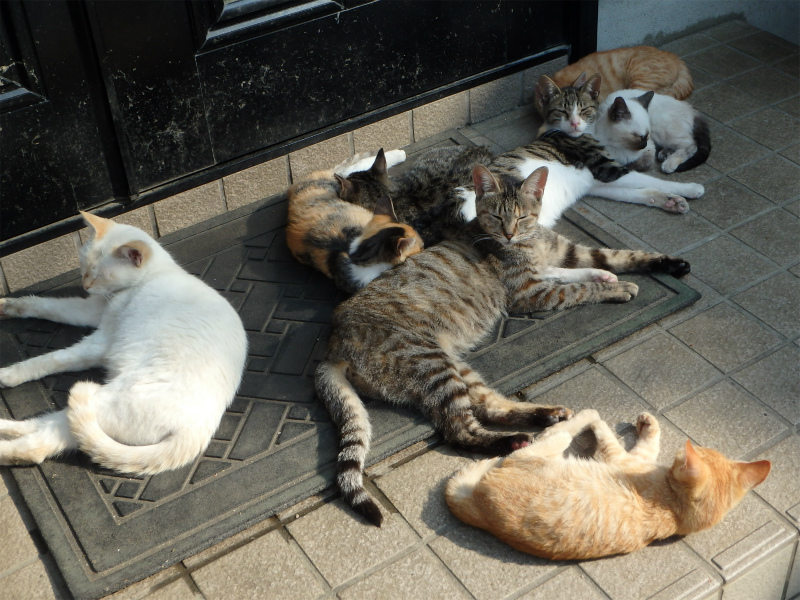
At what (x,y) coordinates should I click in order to perform the action: click on base of wall. Please return your answer as a coordinate pair (x, y). Looking at the image, I should click on (436, 120).